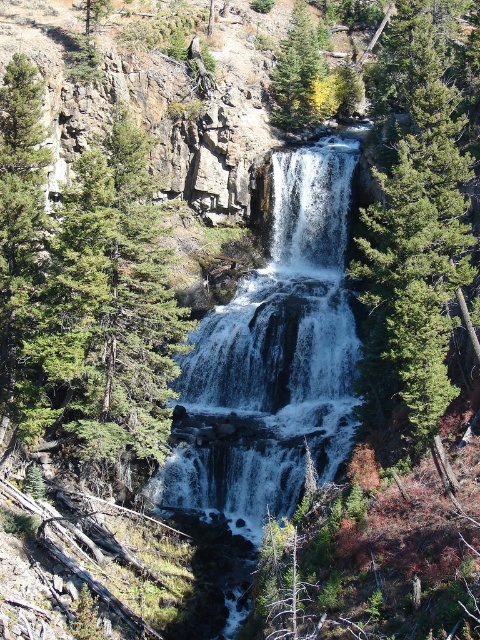
You are standing at the base of the waterfall and want to take a photo of the green textured tree at center. Which direction should you face to capture it in your shot?

The green textured tree at center is located at point coordinates of [106,314], so you should face towards the center of the scene to capture it in your photo.

Looking at this image, you are standing at the base of the waterfall and notice the white textured water at center and the green matte tree at upper center. Which object is positioned to the left when viewed from your perspective?

The white textured water at center is to the left of the green matte tree at upper center from your perspective.